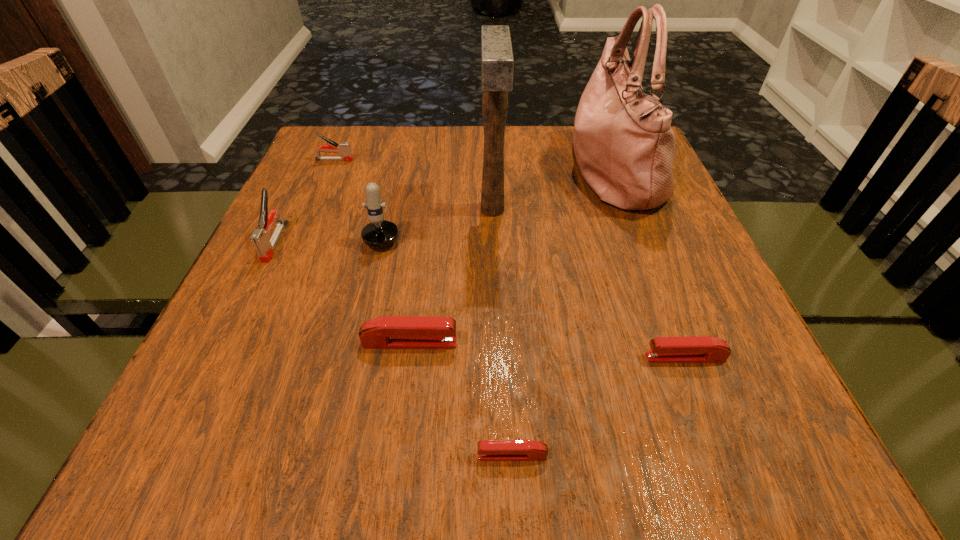
This screenshot has width=960, height=540. I want to click on handbag, so click(624, 145).

Locate an element on the screen. The width and height of the screenshot is (960, 540). mallet is located at coordinates (497, 63).

Where is `the sixth shortest object`? the sixth shortest object is located at coordinates (379, 233).

In order to click on microphone in this screenshot , I will do [379, 233].

In order to click on the fourth nearest stapler in this screenshot , I will do `click(260, 237)`.

Find the location of `the tallest stapler`. the tallest stapler is located at coordinates (260, 237).

Locate an element on the screen. the fifth tallest object is located at coordinates (344, 149).

Image resolution: width=960 pixels, height=540 pixels. Find the location of `the farther gray stapler`. the farther gray stapler is located at coordinates pyautogui.click(x=344, y=149).

Locate an element on the screen. This screenshot has width=960, height=540. the farthest red stapler is located at coordinates (388, 332).

At what (x,y) coordinates should I click in order to perform the action: click on the third tallest stapler. Please return your answer as a coordinate pair (x, y). The height and width of the screenshot is (540, 960). Looking at the image, I should click on (388, 332).